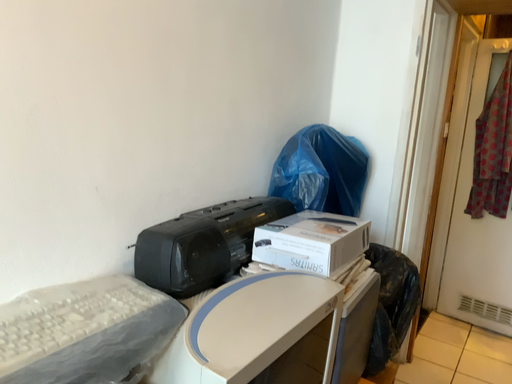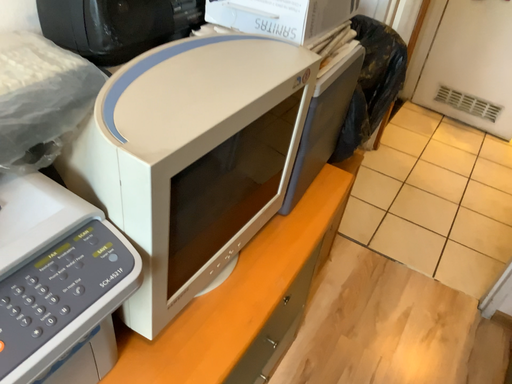
Question: How did the camera likely rotate when shooting the video?

Choices:
 (A) rotated downward
 (B) rotated upward

Answer: (A)